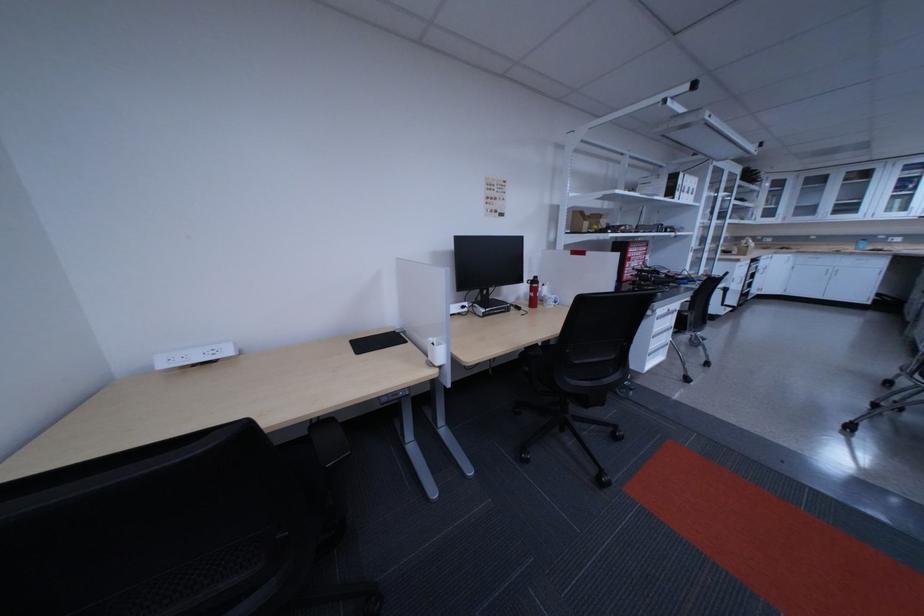
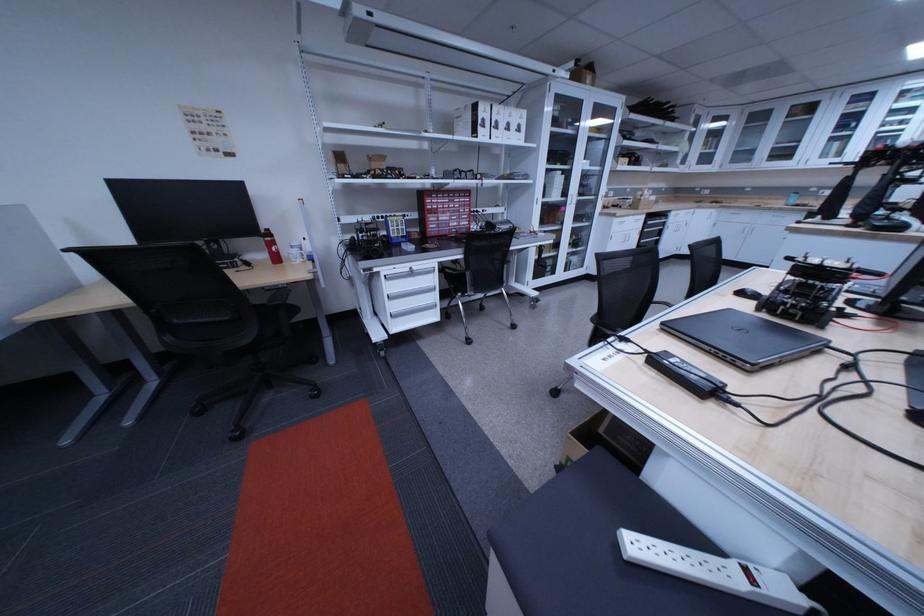
The point at (x=806, y=257) is marked in the first image. Where is the corresponding point in the second image?

(728, 212)